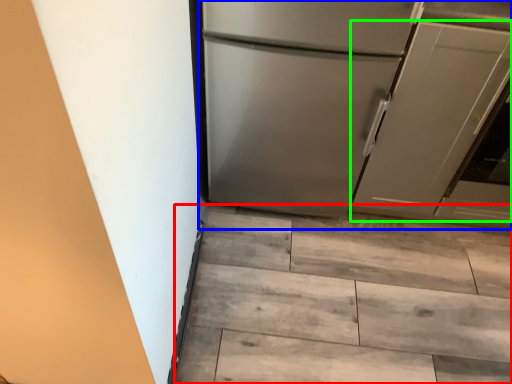
Question: Considering the real-world distances, which object is closest to stairwell (highlighted by a red box)? refrigerator (highlighted by a blue box) or door (highlighted by a green box).

Choices:
 (A) refrigerator
 (B) door

Answer: (A)